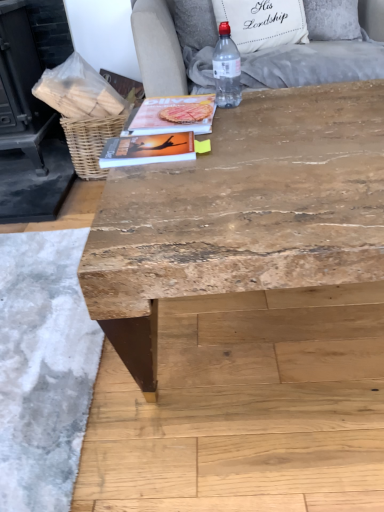
I want to click on vacant space in between matte paper magazine at center, placed as the second magazine when sorted from bottom to top, and clear plastic bottle at upper center, so click(226, 116).